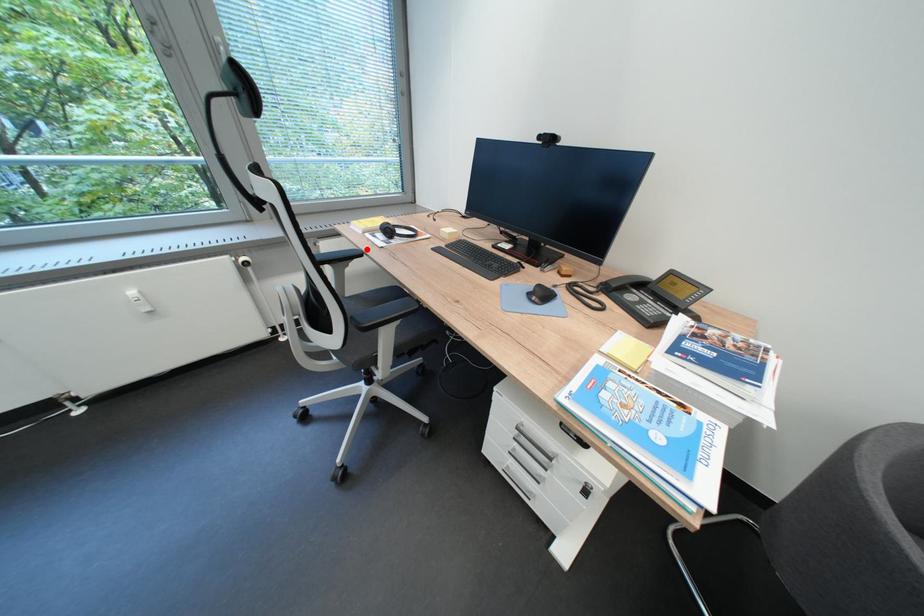
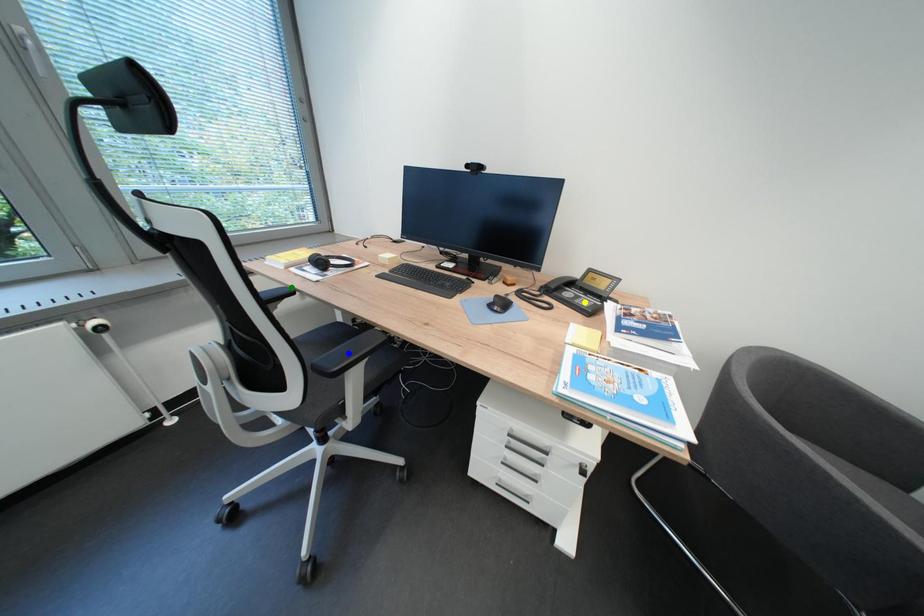
Question: I am providing you with two images of the same scene from different viewpoints. A red point is marked on the first image. You are given multiple points on the second image. Which point in image 2 represents the same 3d spot as the red point in image 1?

Choices:
 (A) green point
 (B) blue point
 (C) yellow point

Answer: (A)